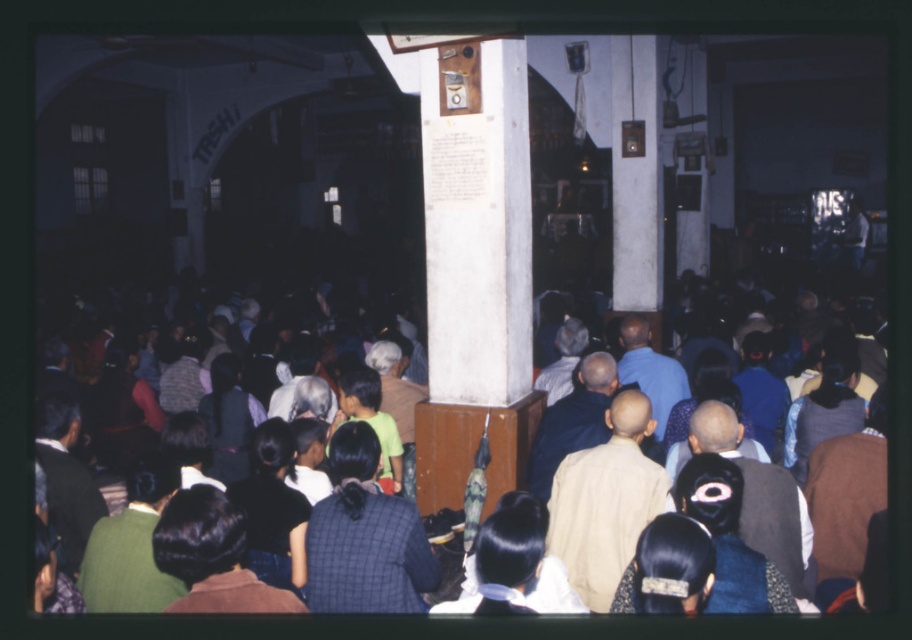
Does dark brown vest at center appear under light brown fabric jacket at center?

Indeed, dark brown vest at center is positioned under light brown fabric jacket at center.

Is dark brown vest at center to the right of light brown fabric jacket at center from the viewer's perspective?

Correct, you'll find dark brown vest at center to the right of light brown fabric jacket at center.

This screenshot has width=912, height=640. I want to click on dark brown vest at center, so click(760, 497).

Can you confirm if dark brown fabric crowd at center is bigger than dark brown vest at center?

No, dark brown fabric crowd at center is not bigger than dark brown vest at center.

Between dark brown fabric crowd at center and dark brown vest at center, which one is positioned higher?

dark brown fabric crowd at center is higher up.

Does point (144, 401) come farther from viewer compared to point (780, 481)?

That is True.

Image resolution: width=912 pixels, height=640 pixels. What are the coordinates of `dark brown fabric crowd at center` in the screenshot? It's located at (174, 413).

Does light brown fabric jacket at center appear under light brown hair at center?

Yes, light brown fabric jacket at center is below light brown hair at center.

Is light brown fabric jacket at center to the left of light brown hair at center from the viewer's perspective?

Correct, you'll find light brown fabric jacket at center to the left of light brown hair at center.

At what (x,y) coordinates should I click in order to perform the action: click on light brown fabric jacket at center. Please return your answer as a coordinate pair (x, y). The width and height of the screenshot is (912, 640). Looking at the image, I should click on pyautogui.click(x=572, y=420).